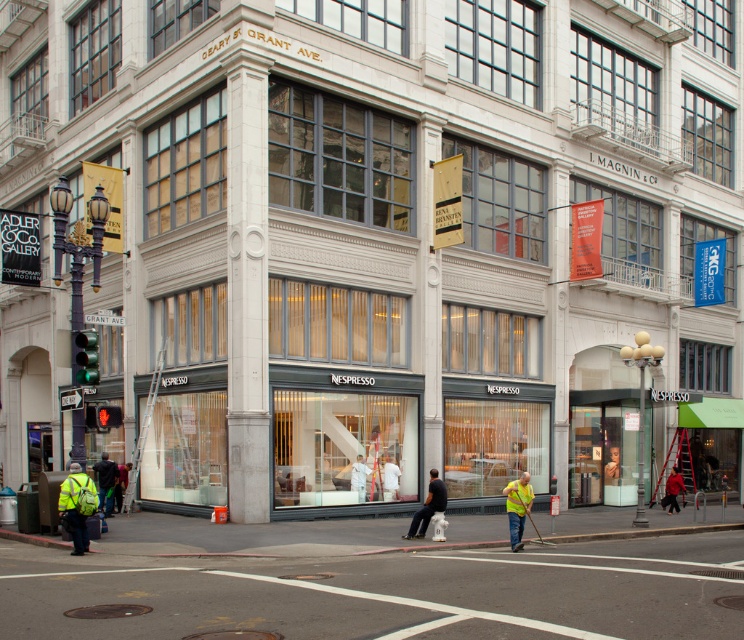
Question: Can you confirm if smooth asphalt road at center is positioned below light brown leather jacket at lower center?

Choices:
 (A) yes
 (B) no

Answer: (A)

Question: Among these objects, which one is farthest from the camera?

Choices:
 (A) smooth asphalt road at center
 (B) reflective yellow safety vest at lower left

Answer: (B)

Question: Is smooth asphalt road at center thinner than reflective yellow safety vest at lower left?

Choices:
 (A) no
 (B) yes

Answer: (A)

Question: Which object appears farthest from the camera in this image?

Choices:
 (A) smooth asphalt road at center
 (B) yellow reflective vest at lower right
 (C) light brown leather jacket at lower center

Answer: (C)

Question: Which object is farther from the camera taking this photo?

Choices:
 (A) reflective yellow safety vest at lower left
 (B) smooth asphalt road at center
 (C) red fabric jacket at lower right
 (D) light brown leather jacket at lower center

Answer: (C)

Question: From the image, what is the correct spatial relationship of yellow reflective vest at lower right in relation to light brown leather jacket at lower center?

Choices:
 (A) left
 (B) right

Answer: (B)